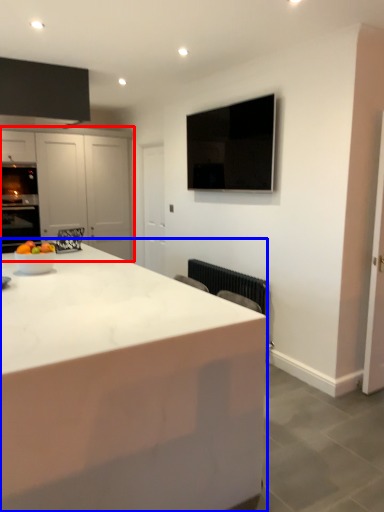
Question: Which point is closer to the camera, cabinetry (highlighted by a red box) or countertop (highlighted by a blue box)?

Choices:
 (A) cabinetry
 (B) countertop

Answer: (B)